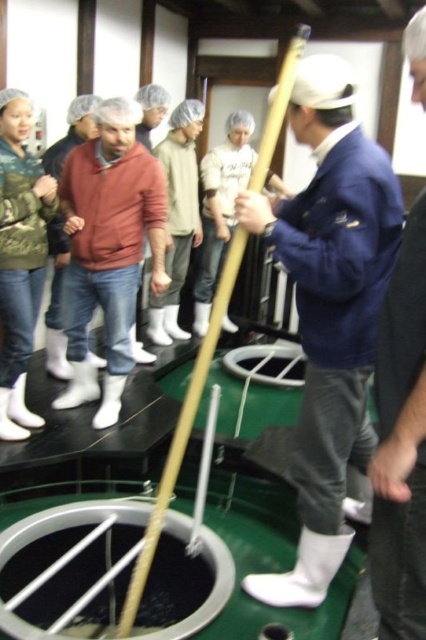
Which is more to the left, smooth black hole at center or white matte jacket at center?

Positioned to the left is smooth black hole at center.

Based on the photo, is smooth black hole at center wider than white matte jacket at center?

Yes, smooth black hole at center is wider than white matte jacket at center.

This screenshot has height=640, width=426. I want to click on smooth black hole at center, so click(65, 564).

Between navy blue jacket at center and smooth black hole at center, which one has less height?

Standing shorter between the two is smooth black hole at center.

Describe the element at coordinates (328, 310) in the screenshot. This screenshot has height=640, width=426. I see `navy blue jacket at center` at that location.

The height and width of the screenshot is (640, 426). Find the location of `navy blue jacket at center`. navy blue jacket at center is located at coordinates (328, 310).

Who is positioned more to the right, white matte jacket at center or white plastic hole at center?

From the viewer's perspective, white matte jacket at center appears more on the right side.

Does white matte jacket at center have a smaller size compared to white plastic hole at center?

Indeed, white matte jacket at center has a smaller size compared to white plastic hole at center.

Locate an element on the screen. The height and width of the screenshot is (640, 426). white matte jacket at center is located at coordinates (400, 444).

Where is `white matte jacket at center`? white matte jacket at center is located at coordinates (400, 444).